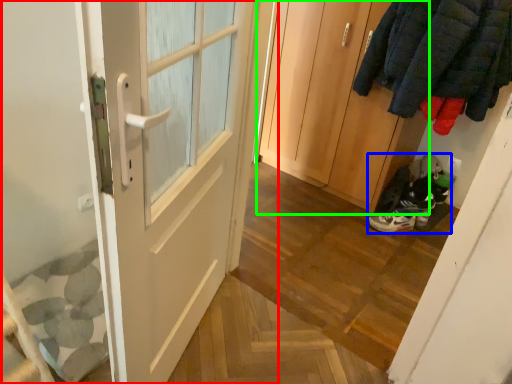
Question: Based on their relative distances, which object is nearer to door (highlighted by a red box)? Choose from footwear (highlighted by a blue box) and door (highlighted by a green box).

Choices:
 (A) footwear
 (B) door

Answer: (B)